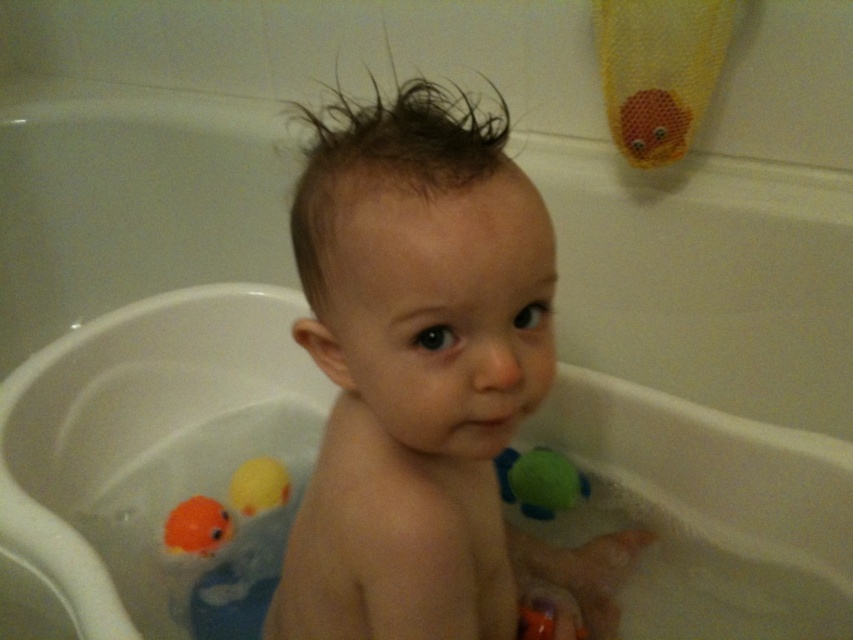
Is smooth skin baby at center shorter than yellow rubber duck at lower left?

In fact, smooth skin baby at center may be taller than yellow rubber duck at lower left.

Is point (433, 634) closer to viewer compared to point (265, 508)?

That is True.

The width and height of the screenshot is (853, 640). Find the location of `smooth skin baby at center`. smooth skin baby at center is located at coordinates (426, 385).

Which is in front, point (548, 449) or point (248, 477)?

Point (248, 477) is more forward.

Which is more to the right, green rubber ball at right or yellow rubber duck at lower left?

green rubber ball at right is more to the right.

At what (x,y) coordinates should I click in order to perform the action: click on green rubber ball at right. Please return your answer as a coordinate pair (x, y). Looking at the image, I should click on (538, 481).

Does smooth skin baby at center come in front of green rubber ball at right?

Yes, it is in front of green rubber ball at right.

Which is more to the right, smooth skin baby at center or green rubber ball at right?

green rubber ball at right

Is point (618, 561) closer to camera compared to point (544, 500)?

Yes, point (618, 561) is closer to viewer.

The image size is (853, 640). I want to click on smooth skin baby at center, so click(x=426, y=385).